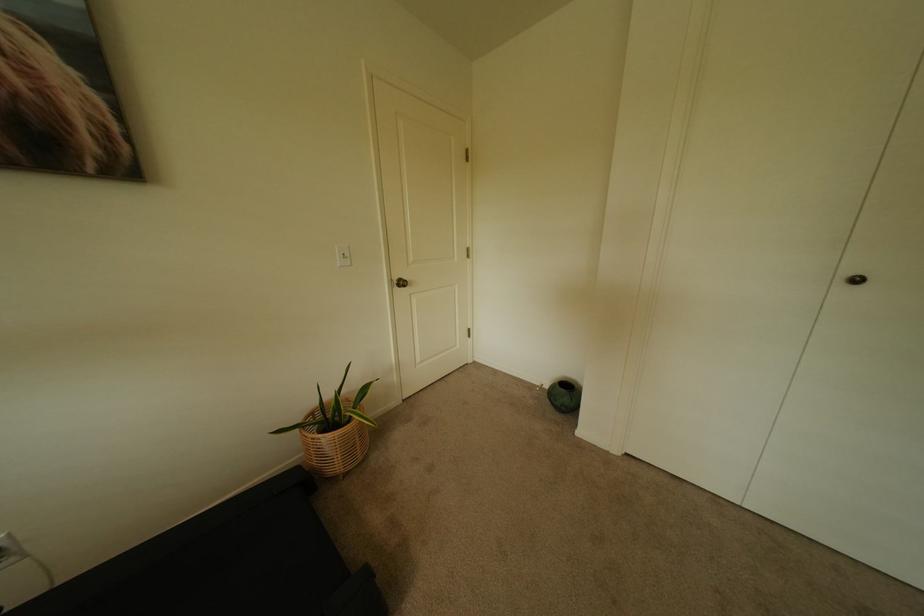
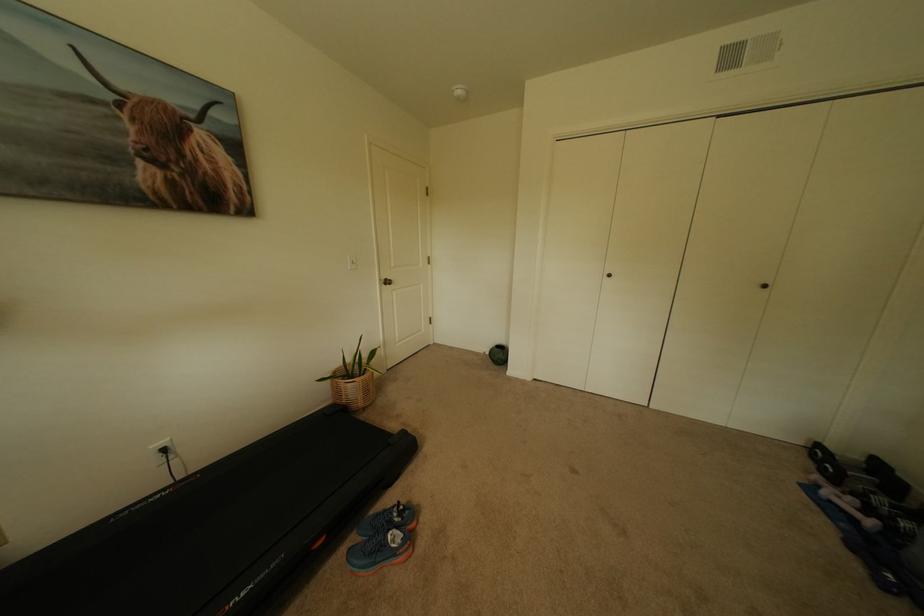
In the second image, find the point that corresponds to point (403, 280) in the first image.

(391, 280)